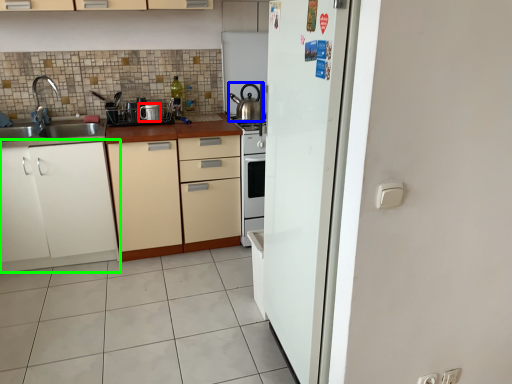
Question: Estimate the real-world distances between objects in this image. Which object is closer to appliance (highlighted by a red box), kitchen appliance (highlighted by a blue box) or cabinetry (highlighted by a green box)?

Choices:
 (A) kitchen appliance
 (B) cabinetry

Answer: (A)